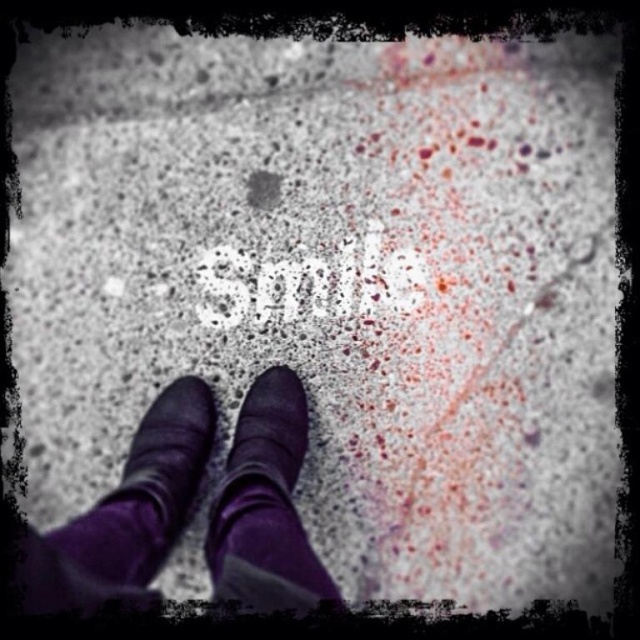
Is point (122, 481) closer to camera compared to point (145, 531)?

That is False.

The height and width of the screenshot is (640, 640). What do you see at coordinates (125, 513) in the screenshot?
I see `purple suede boots at center` at bounding box center [125, 513].

Who is more forward, (205, 550) or (161, 472)?

Point (205, 550) is in front.

You are a GUI agent. You are given a task and a screenshot of the screen. Output one action in this format:
    pyautogui.click(x=<x>, y=<y>)
    Task: Click on the purple suede boots at center
    
    Given the screenshot: What is the action you would take?
    click(125, 513)

Does purple suede boot at lower center have a lesser width compared to white speckled paper at center?

Indeed, purple suede boot at lower center has a lesser width compared to white speckled paper at center.

Can you confirm if purple suede boot at lower center is shorter than white speckled paper at center?

No.

Which is in front, point (160, 493) or point (317, 276)?

Point (160, 493) is in front.

Identify the location of purple suede boot at lower center. The image size is (640, 640). (145, 492).

Based on the photo, is purple suede sock at center wider than purple suede boot at lower center?

No, purple suede sock at center is not wider than purple suede boot at lower center.

Between purple suede sock at center and purple suede boot at lower center, which one has more height?

With more height is purple suede sock at center.

This screenshot has width=640, height=640. Describe the element at coordinates (266, 506) in the screenshot. I see `purple suede sock at center` at that location.

Where is `purple suede sock at center`? This screenshot has height=640, width=640. purple suede sock at center is located at coordinates [266, 506].